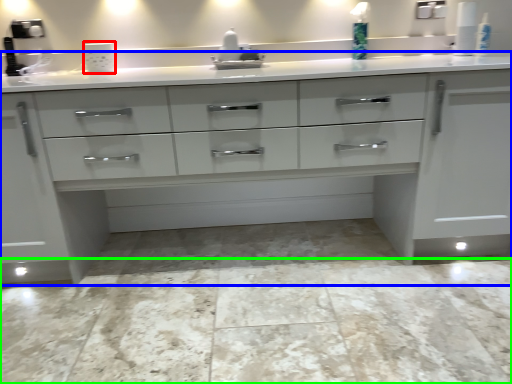
Question: Which object is positioned farthest from appliance (highlighted by a red box)? Select from chest of drawers (highlighted by a blue box) and granite (highlighted by a green box).

Choices:
 (A) chest of drawers
 (B) granite

Answer: (B)